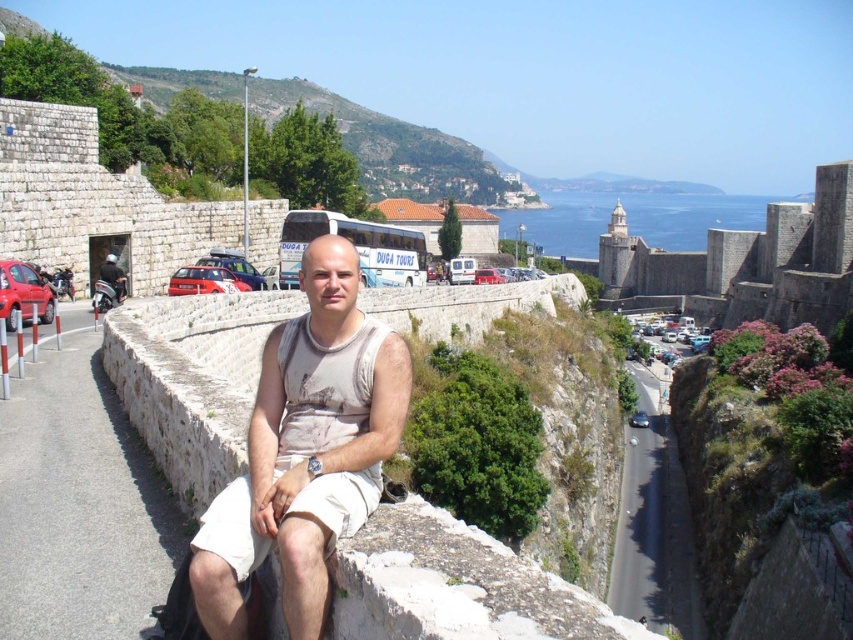
You are a hiker standing at the base of the historic stone wall. You see a white stone ledge at center and a stone wall at upper right. How far apart are these two landmarks?

The white stone ledge at center is 355.48 feet away from the stone wall at upper right.

You are a tourist standing at the edge of the historic stone wall. You see the white stone ledge at center and the stone wall at upper right. Which structure is taller?

The stone wall at upper right is taller than the white stone ledge at center.

You are a photographer trying to capture the entire white stone ledge at center and the white cotton tank top at center in a single frame. Given that your camera has a fixed focal length, which object should you focus on to ensure both are fully visible?

You should focus on the white stone ledge at center since it is larger in size than the white cotton tank top at center, allowing it to dominate the frame while still accommodating the smaller object.